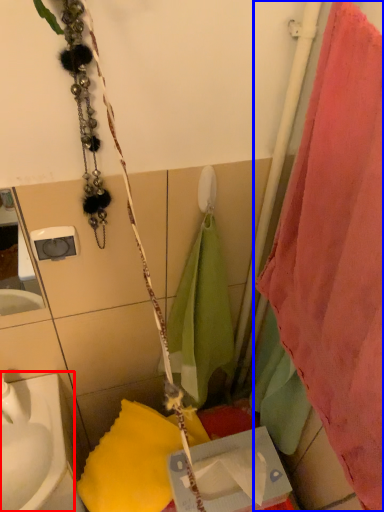
Question: Among these objects, which one is nearest to the camera, sink (highlighted by a red box) or curtain (highlighted by a blue box)?

Choices:
 (A) sink
 (B) curtain

Answer: (B)